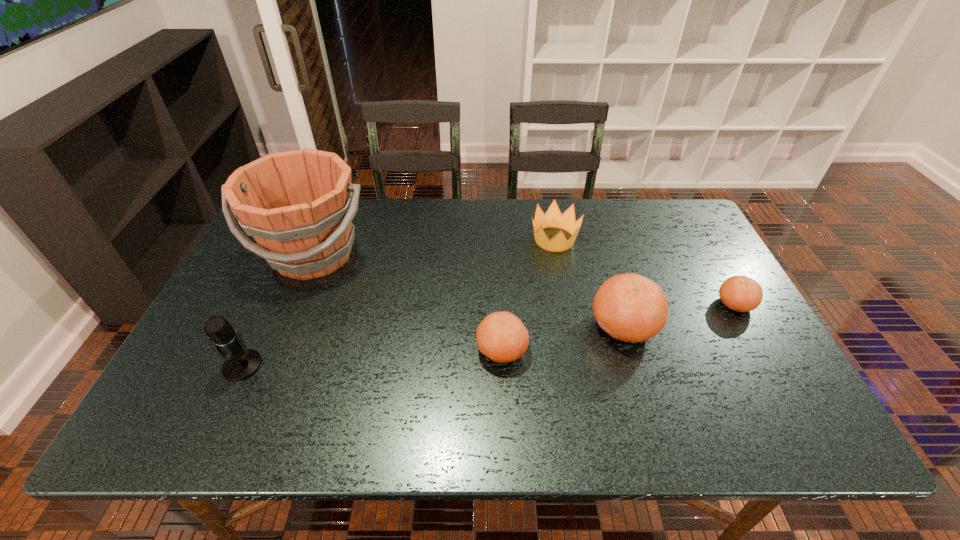
Locate an element on the screen. The height and width of the screenshot is (540, 960). free space between the shortest object and the bucket is located at coordinates (524, 279).

Identify the location of free space that is in between the tallest clementine and the crown. (589, 282).

In order to click on empty location between the tallest clementine and the second tallest clementine in this screenshot , I will do `click(563, 338)`.

Identify the location of vacant area that lies between the second clementine from right to left and the leftmost clementine. (563, 338).

Locate an element on the screen. free space that is in between the fourth shortest object and the tallest object is located at coordinates (468, 290).

Where is `empty space between the microphone and the crown`? Image resolution: width=960 pixels, height=540 pixels. empty space between the microphone and the crown is located at coordinates (398, 302).

Locate which object ranks third in proximity to the third tallest object. Please provide its 2D coordinates. Your answer should be formatted as a tuple, i.e. [(x, y)], where the tuple contains the x and y coordinates of a point satisfying the conditions above.

[(553, 218)]

Find the location of a particular element. This screenshot has width=960, height=540. the third closest object relative to the leftmost clementine is located at coordinates (298, 205).

Identify which clementine is located as the nearest to the shortest clementine. Please provide its 2D coordinates. Your answer should be formatted as a tuple, i.e. [(x, y)], where the tuple contains the x and y coordinates of a point satisfying the conditions above.

[(629, 307)]

I want to click on the second closest clementine relative to the second clementine from left to right, so click(739, 293).